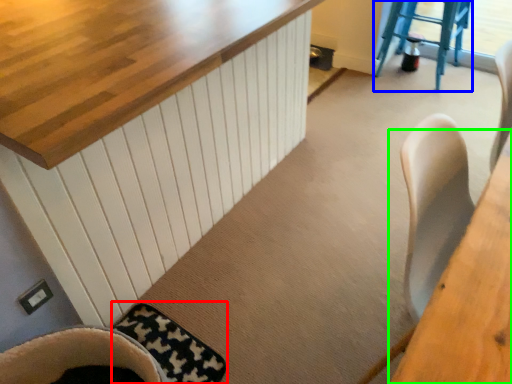
Question: Estimate the real-world distances between objects in this image. Which object is farther from mat (highlighted by a red box), step stool (highlighted by a blue box) or table (highlighted by a green box)?

Choices:
 (A) step stool
 (B) table

Answer: (A)